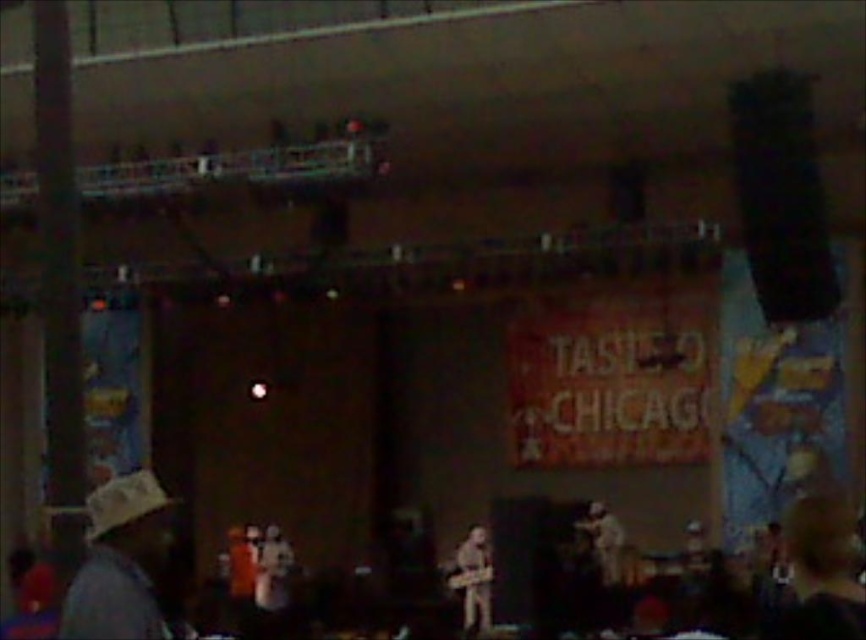
You are a photographer at the Taste of Chicago event. You need to capture a photo that includes both the khaki fabric hat at lower left and the brown leather guitar at center. Which object will appear taller in the photo?

The brown leather guitar at center is taller than the khaki fabric hat at lower left, so it will appear taller in the photo.

You are a photographer at the Taste of Chicago event. You want to capture a photo that includes both the khaki fabric hat at lower left and the brown leather guitar at center. Which object should you zoom in on to ensure both fit in the frame?

The khaki fabric hat at lower left is smaller than the brown leather guitar at center, so you should zoom in on the brown leather guitar at center to ensure both objects fit in the frame.